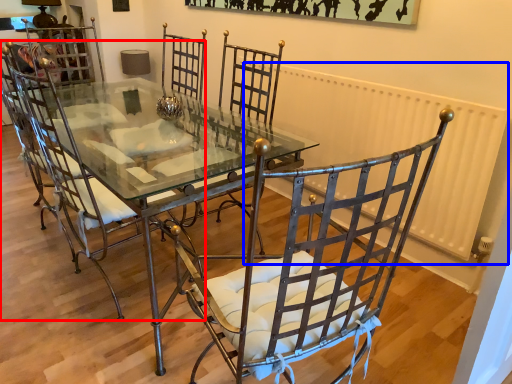
Question: Which of the following is the farthest to the observer, chair (highlighted by a red box) or radiator (highlighted by a blue box)?

Choices:
 (A) chair
 (B) radiator

Answer: (B)